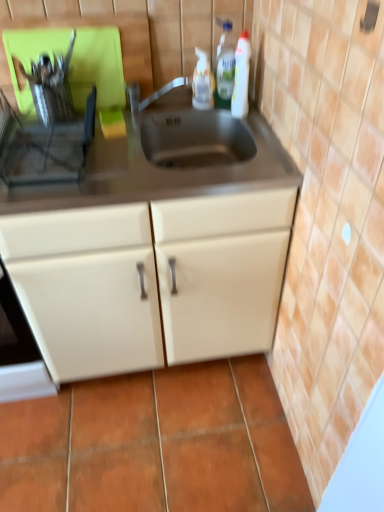
At what (x,y) coordinates should I click in order to perform the action: click on free space in front of white plastic bottle at upper right, the third bottle viewed from the left. Please return your answer as a coordinate pair (x, y). Image resolution: width=384 pixels, height=512 pixels. Looking at the image, I should click on (259, 135).